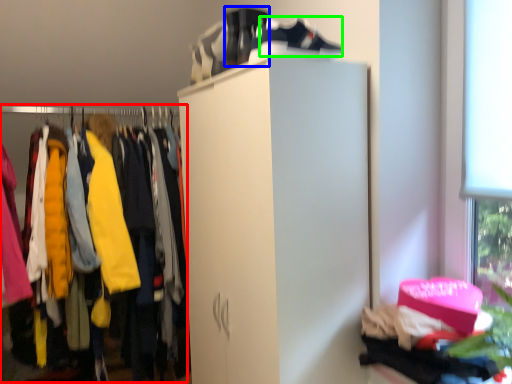
Question: Which object is positioned farthest from closet (highlighted by a red box)? Select from running shoe (highlighted by a blue box) and shoe (highlighted by a green box).

Choices:
 (A) running shoe
 (B) shoe

Answer: (B)